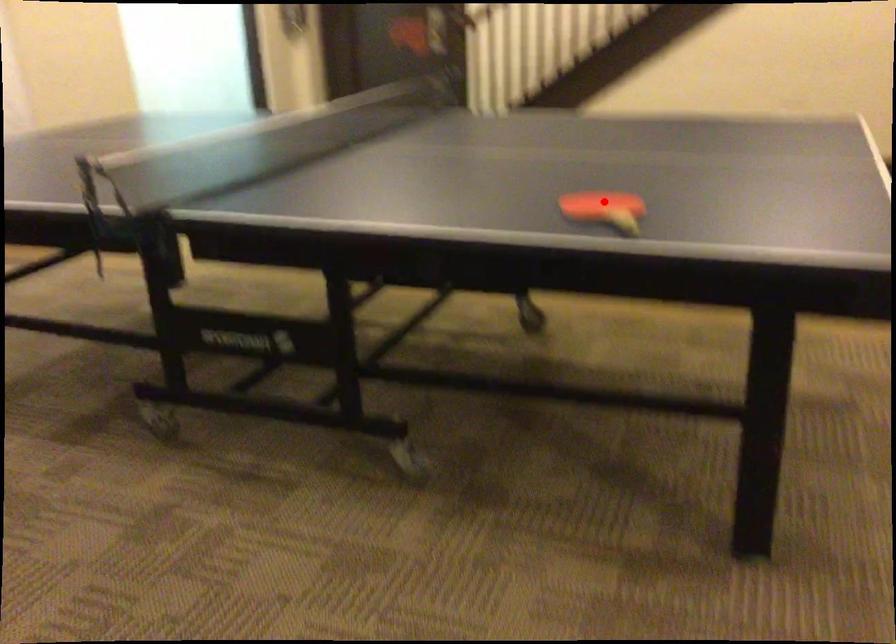
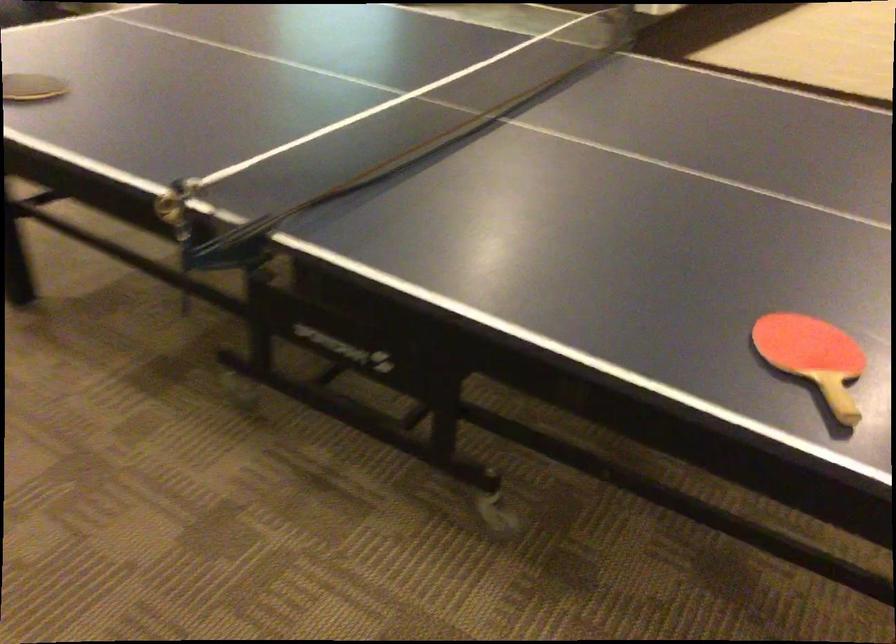
Find the pixel in the second image that matches the highlighted location in the first image.

(813, 357)